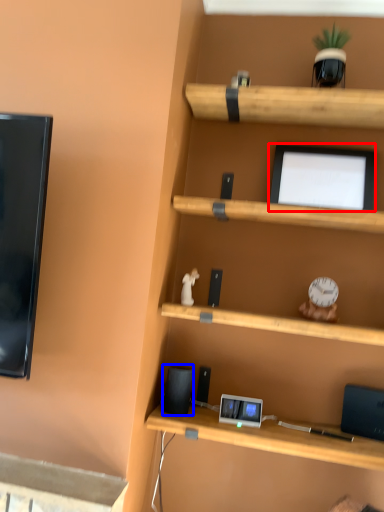
Question: Among these objects, which one is farthest to the camera, computer monitor (highlighted by a red box) or speaker (highlighted by a blue box)?

Choices:
 (A) computer monitor
 (B) speaker

Answer: (A)